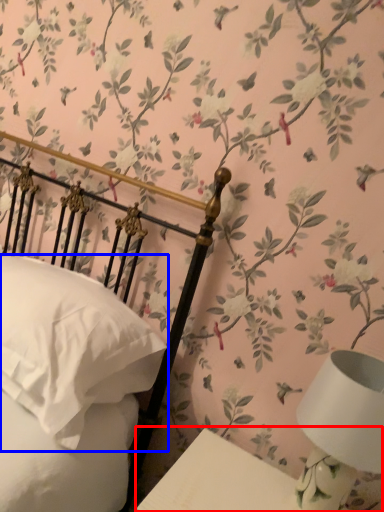
Question: Which of the following is the closest to the observer, table (highlighted by a red box) or pillow (highlighted by a blue box)?

Choices:
 (A) table
 (B) pillow

Answer: (A)